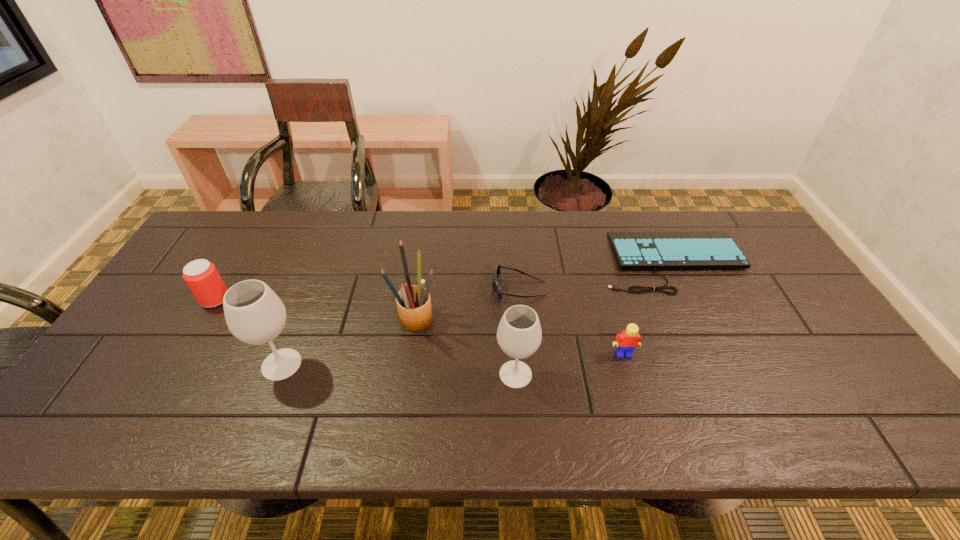
You are a GUI agent. You are given a task and a screenshot of the screen. Output one action in this format:
    pyautogui.click(x=<x>, y=<y>)
    Task: Click on the vacant space situated on the left of the shortest object
    This screenshot has height=540, width=960.
    Given the screenshot: What is the action you would take?
    pyautogui.click(x=529, y=261)

Find the location of `vacant space situated 0.170m on the front-facing side of the second shortest object`. vacant space situated 0.170m on the front-facing side of the second shortest object is located at coordinates (434, 288).

Where is `vacant space located 0.400m on the front-facing side of the second shortest object`? The height and width of the screenshot is (540, 960). vacant space located 0.400m on the front-facing side of the second shortest object is located at coordinates (355, 288).

The height and width of the screenshot is (540, 960). I want to click on free space located 0.390m on the front-facing side of the second shortest object, so click(358, 288).

Locate an element on the screen. The height and width of the screenshot is (540, 960). free space located on the back of the beer can is located at coordinates (243, 251).

You are a GUI agent. You are given a task and a screenshot of the screen. Output one action in this format:
    pyautogui.click(x=<x>, y=<y>)
    Task: Click on the free space located on the back of the pencil box
    
    Given the screenshot: What is the action you would take?
    pyautogui.click(x=425, y=247)

At what (x,y) coordinates should I click in order to perform the action: click on vacant space located on the front-facing side of the Lego. Please return your answer as a coordinate pair (x, y). Looking at the image, I should click on 635,393.

At what (x,y) coordinates should I click in order to perform the action: click on object that is at the far edge. Please return your answer as a coordinate pair (x, y). The height and width of the screenshot is (540, 960). Looking at the image, I should click on (705, 249).

Identify the location of object located in the left edge section of the desktop. Image resolution: width=960 pixels, height=540 pixels. (201, 276).

Find the location of a particular element. This screenshot has width=960, height=540. object located in the right edge section of the desktop is located at coordinates (705, 249).